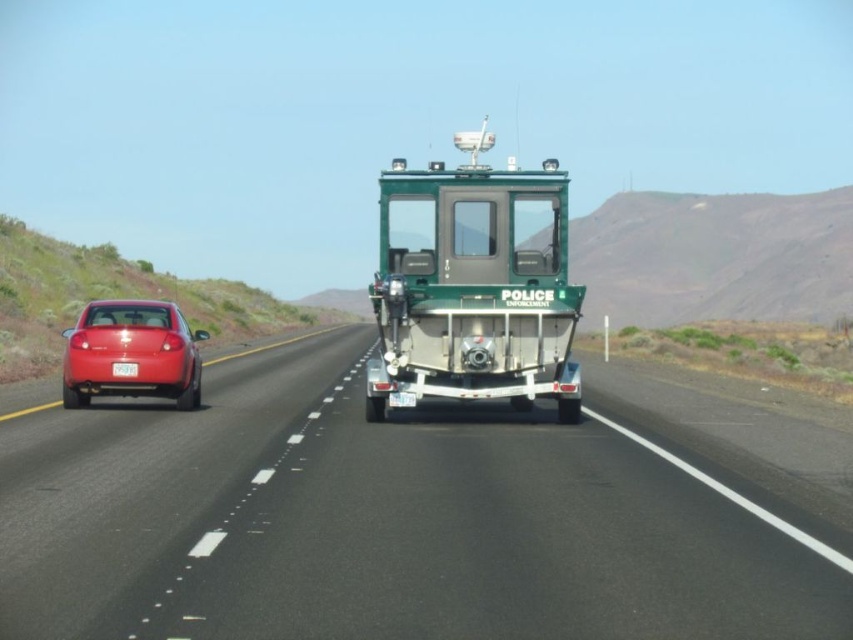
Question: Is black asphalt road at center positioned behind matte red car at left?

Choices:
 (A) no
 (B) yes

Answer: (A)

Question: Among these objects, which one is farthest from the camera?

Choices:
 (A) black asphalt road at center
 (B) matte red car at left
 (C) white plastic license plate at center

Answer: (B)

Question: Is the position of matte red car at left more distant than that of white plastic license plate at center?

Choices:
 (A) yes
 (B) no

Answer: (A)

Question: Where is black asphalt road at center located in relation to green matte police boat at center in the image?

Choices:
 (A) below
 (B) above

Answer: (A)

Question: Which point is closer to the camera?

Choices:
 (A) (486, 358)
 (B) (135, 374)
 (C) (84, 636)

Answer: (C)

Question: Based on their relative distances, which object is farther from the green matte police boat at center?

Choices:
 (A) matte red car at left
 (B) black asphalt road at center
 (C) white plastic license plate at center

Answer: (A)